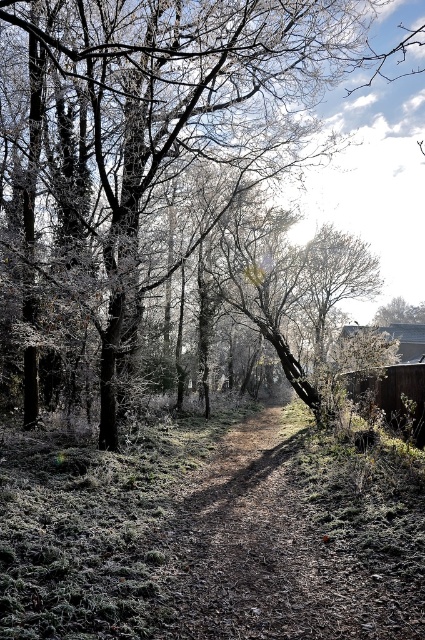
You are standing at the center of the forest path and see the point marked as point (175, 115). What object is located at that point?

The point (175, 115) indicates a glossy bark tree at center.

You are a hiker walking along the brown dirt track at center. You notice a glossy bark tree at center ahead. Which object is closer to you as you walk?

The glossy bark tree at center is closer to you than the brown dirt track at center because it is positioned further to the viewer.